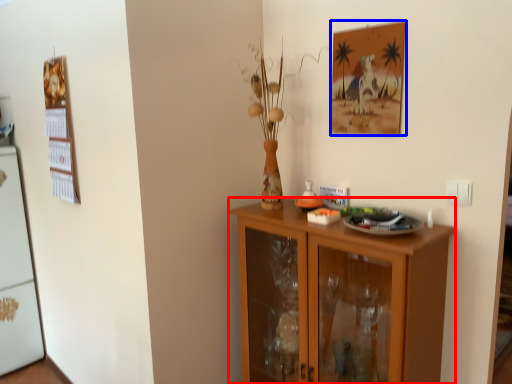
Question: Which object appears closest to the camera in this image, cabinetry (highlighted by a red box) or picture frame (highlighted by a blue box)?

Choices:
 (A) cabinetry
 (B) picture frame

Answer: (A)